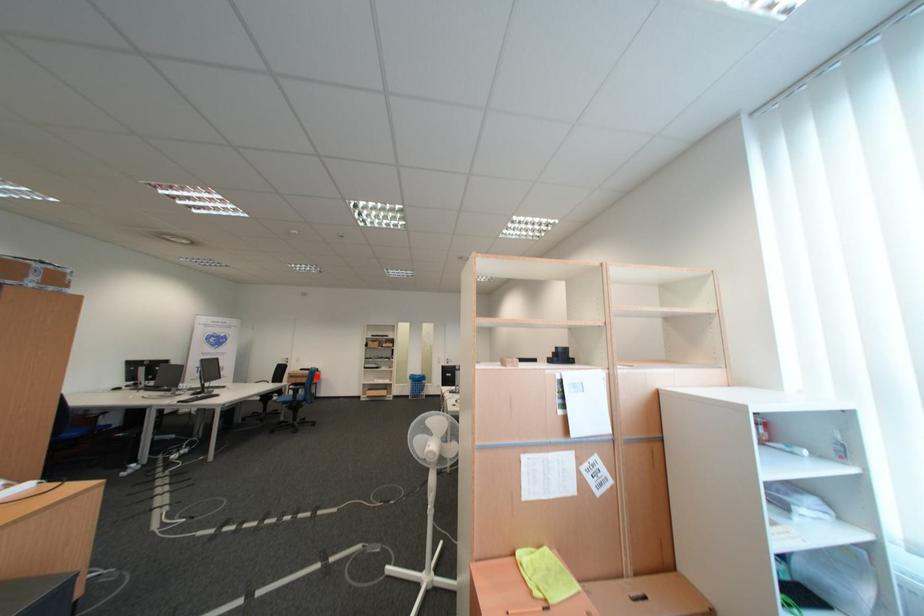
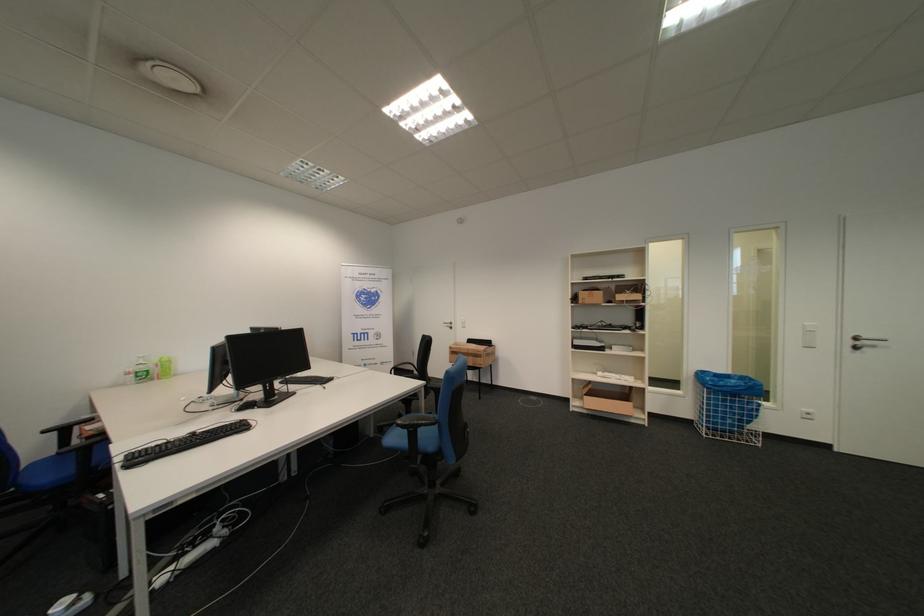
The point at the highlighted location is marked in the first image. Where is the corresponding point in the second image?

(482, 353)